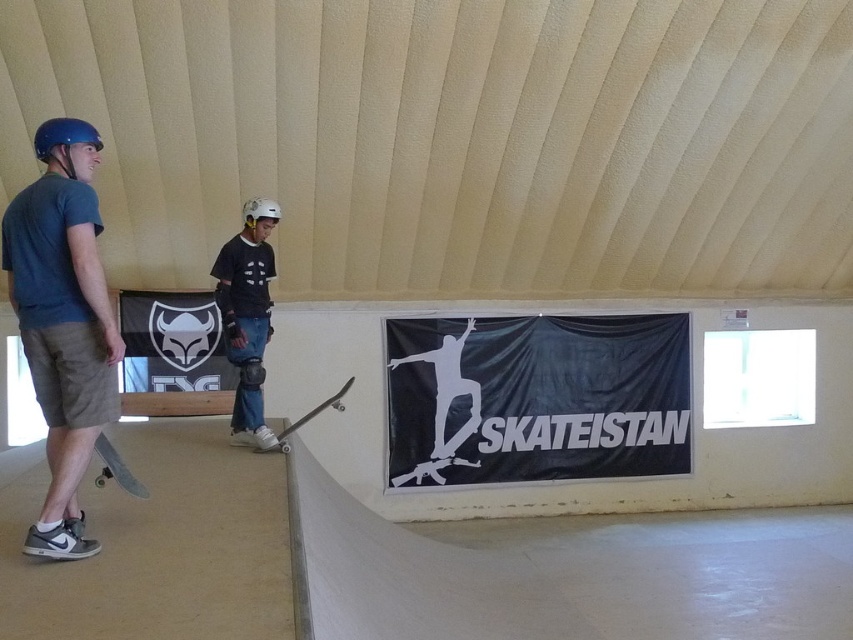
Question: Is white smooth ramp at center behind wooden skateboard at center?

Choices:
 (A) no
 (B) yes

Answer: (A)

Question: Does white smooth ramp at center have a larger size compared to wooden skateboard at lower left?

Choices:
 (A) no
 (B) yes

Answer: (B)

Question: Which point is farther from the camera taking this photo?

Choices:
 (A) (54, 323)
 (B) (107, 464)
 (C) (299, 534)
 (D) (257, 381)

Answer: (D)

Question: Which point appears closest to the camera in this image?

Choices:
 (A) (4, 212)
 (B) (129, 472)
 (C) (300, 422)

Answer: (A)

Question: Can you confirm if matte black skateboard at center is bigger than wooden skateboard at lower left?

Choices:
 (A) no
 (B) yes

Answer: (B)

Question: Considering the real-world distances, which object is closest to the matte black skateboard at center?

Choices:
 (A) wooden skateboard at center
 (B) wooden skateboard at lower left
 (C) white smooth ramp at center

Answer: (A)